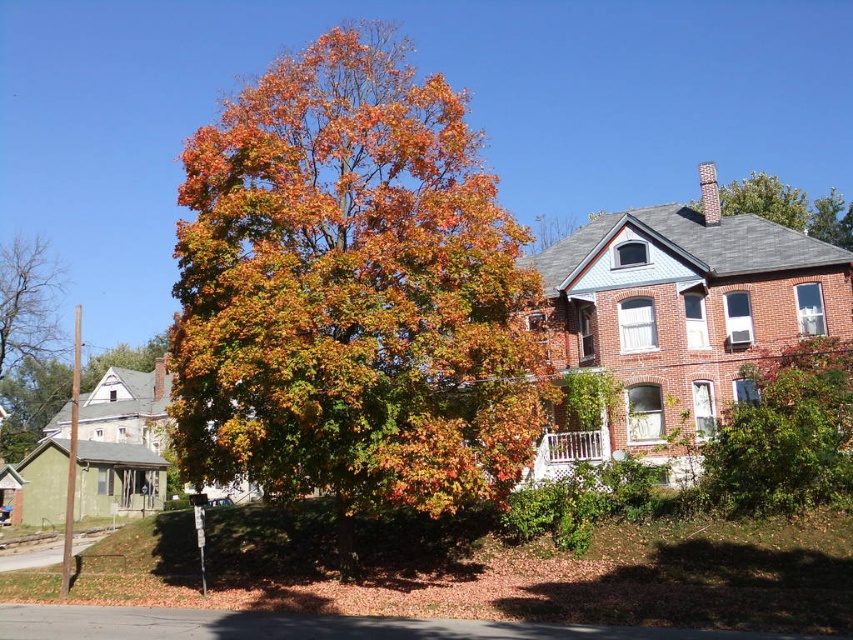
Which is below, multicolored foliage at center or bare branches at left?

bare branches at left

The width and height of the screenshot is (853, 640). Describe the element at coordinates (352, 292) in the screenshot. I see `multicolored foliage at center` at that location.

You are a GUI agent. You are given a task and a screenshot of the screen. Output one action in this format:
    pyautogui.click(x=<x>, y=<y>)
    Task: Click on the multicolored foliage at center
    The height and width of the screenshot is (640, 853).
    Given the screenshot: What is the action you would take?
    pyautogui.click(x=352, y=292)